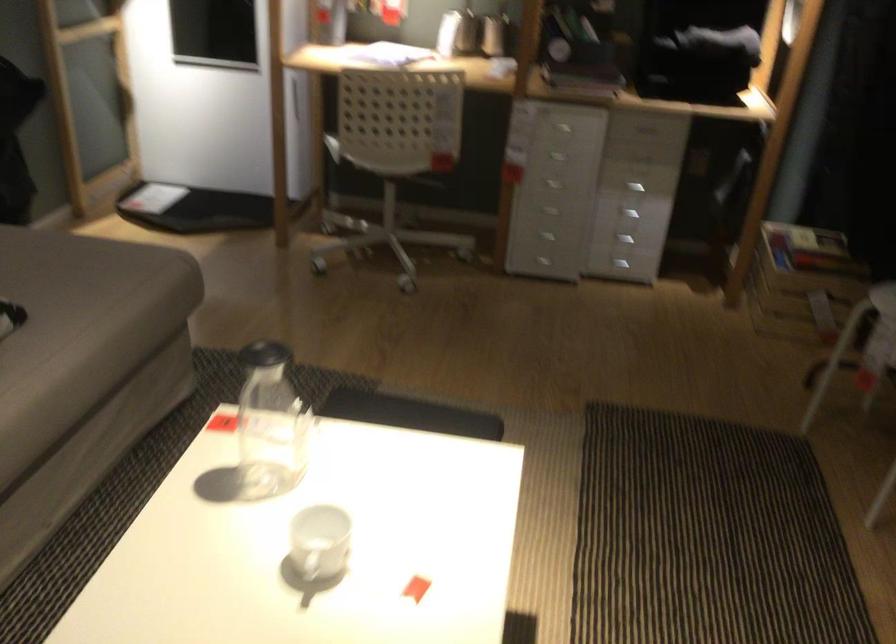
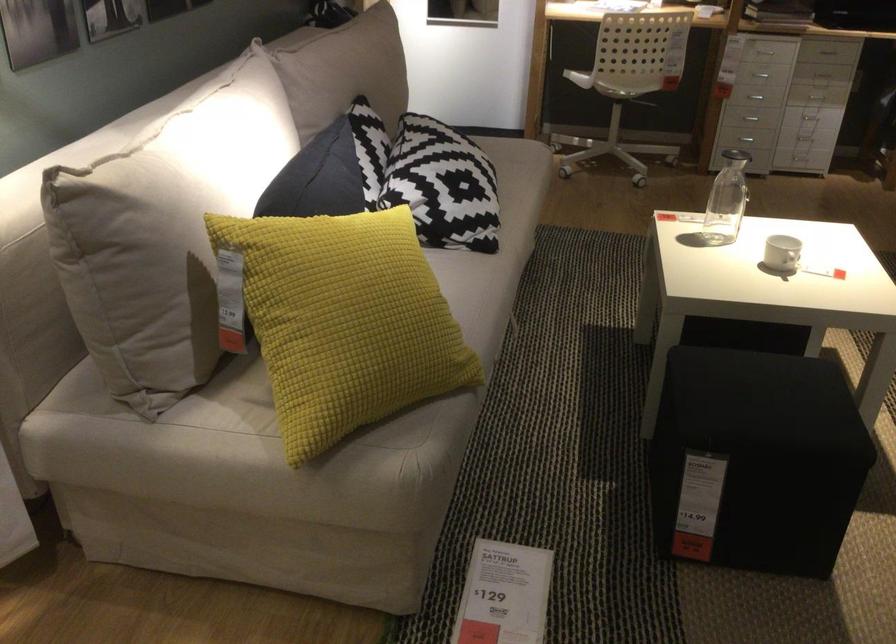
Locate, in the second image, the point that corresponds to (314,535) in the first image.

(781, 252)